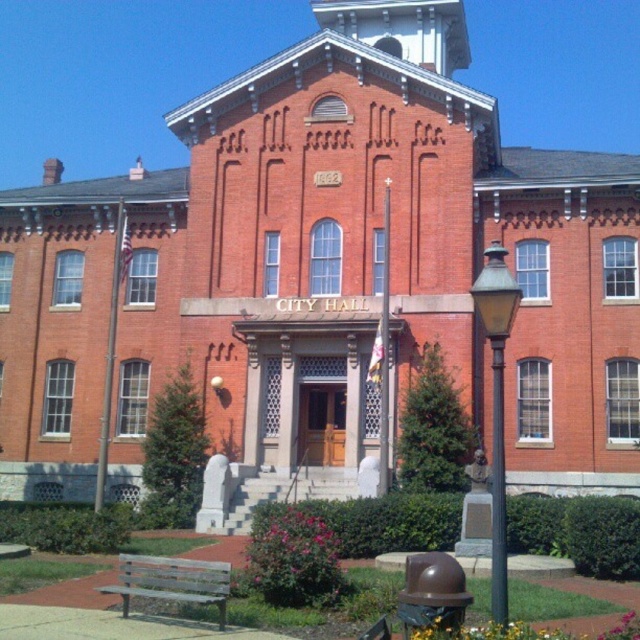
You are a visitor standing in front of the historic red brick building called CITY HALL. You see a wooden bench at lower left and a metallic pole at right. Which object is shorter?

The wooden bench at lower left has a lesser height compared to the metallic pole at right, so the wooden bench at lower left is shorter.

You are standing in front of the historic red brick building called CITY HALL. You see a matte black lamp post at lower right and a wooden bench at lower left. Which object is positioned higher from the ground?

The matte black lamp post at lower right is located above the wooden bench at lower left, so it is positioned higher from the ground.